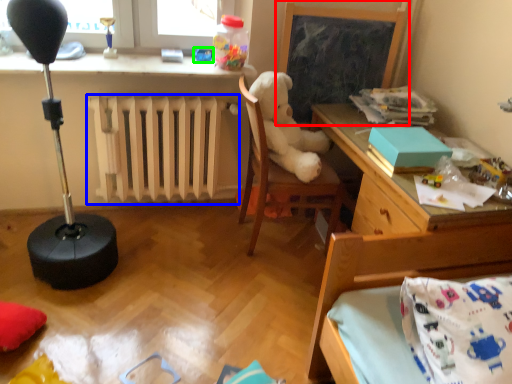
Question: Which object is the closest to the bulletin board (highlighted by a red box)? Choose among these: radiator (highlighted by a blue box) or toy (highlighted by a green box).

Choices:
 (A) radiator
 (B) toy

Answer: (B)